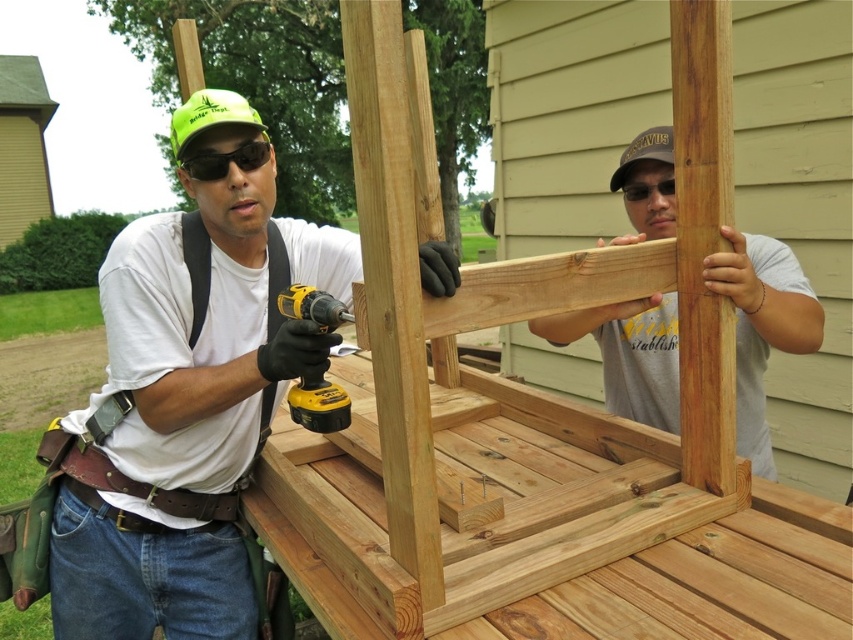
Between matte black drill at center and light brown wood at center, which one has more height?

matte black drill at center is taller.

Can you confirm if matte black drill at center is shorter than light brown wood at center?

Incorrect, matte black drill at center's height does not fall short of light brown wood at center's.

Is point (209, 406) less distant than point (675, 365)?

Yes, point (209, 406) is closer to viewer.

Locate an element on the screen. matte black drill at center is located at coordinates (187, 413).

Which is in front, point (323, 376) or point (258, 161)?

Positioned in front is point (258, 161).

Is yellow/black cordless drill at center shorter than green matte/glossy goggles at upper center?

No.

Which is in front, point (335, 406) or point (254, 166)?

Point (335, 406) is in front.

I want to click on yellow/black cordless drill at center, so click(318, 403).

Who is positioned more to the left, light brown wood at center or yellow/black cordless drill at center?

yellow/black cordless drill at center is more to the left.

Can you confirm if light brown wood at center is taller than yellow/black cordless drill at center?

Indeed, light brown wood at center has a greater height compared to yellow/black cordless drill at center.

Between point (674, 308) and point (317, 396), which one is positioned in front?

Point (317, 396)

Find the location of `light brown wood at center`. light brown wood at center is located at coordinates (762, 326).